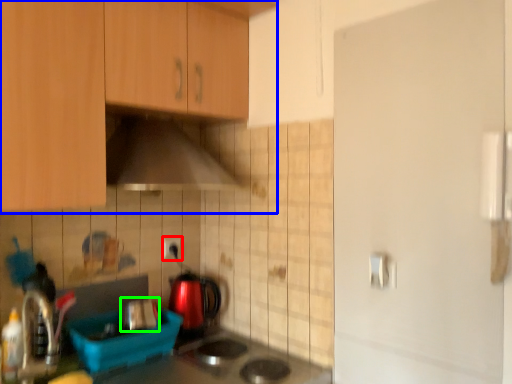
Question: Considering the real-world distances, which object is farthest from electric outlet (highlighted by a red box)? cabinetry (highlighted by a blue box) or appliance (highlighted by a green box)?

Choices:
 (A) cabinetry
 (B) appliance

Answer: (A)